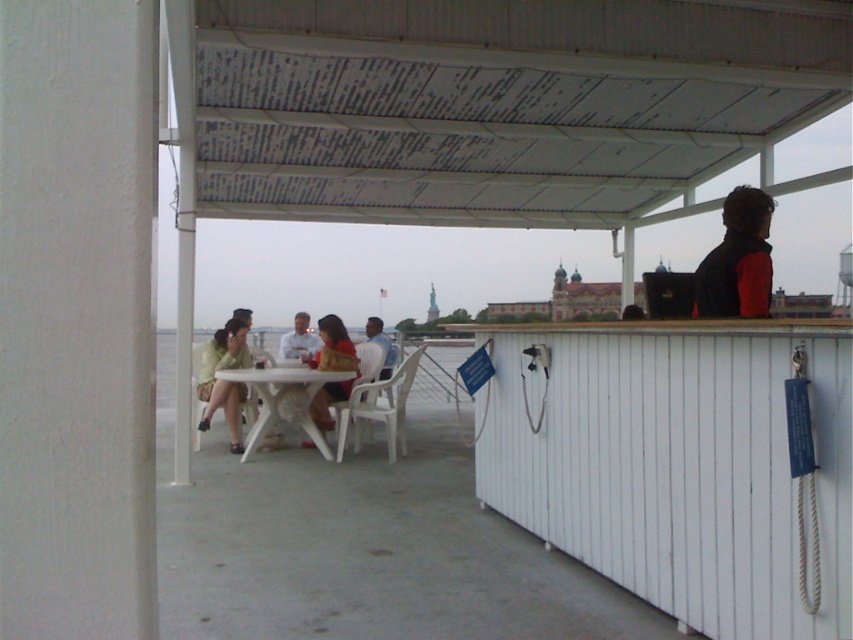
Image resolution: width=853 pixels, height=640 pixels. Describe the element at coordinates (737, 260) in the screenshot. I see `red fleece jacket at right` at that location.

Which is behind, point (762, 228) or point (390, 356)?

The point (390, 356) is behind.

Locate an element on the screen. The width and height of the screenshot is (853, 640). red fleece jacket at right is located at coordinates (737, 260).

Based on the photo, is white plastic table at center above light green fabric dress at lower left?

Incorrect, white plastic table at center is not positioned above light green fabric dress at lower left.

Who is lower down, white plastic table at center or light green fabric dress at lower left?

white plastic table at center is below.

Does point (260, 380) come farther from viewer compared to point (206, 392)?

No, (260, 380) is closer to viewer.

Locate an element on the screen. white plastic table at center is located at coordinates (283, 401).

Is red fleece jacket at right wider than white plastic table at center?

Incorrect, red fleece jacket at right's width does not surpass white plastic table at center's.

Who is higher up, red fleece jacket at right or white plastic table at center?

red fleece jacket at right

Who is more forward, [711,276] or [334,372]?

Point [711,276]

Where is `red fleece jacket at right`? red fleece jacket at right is located at coordinates (737, 260).